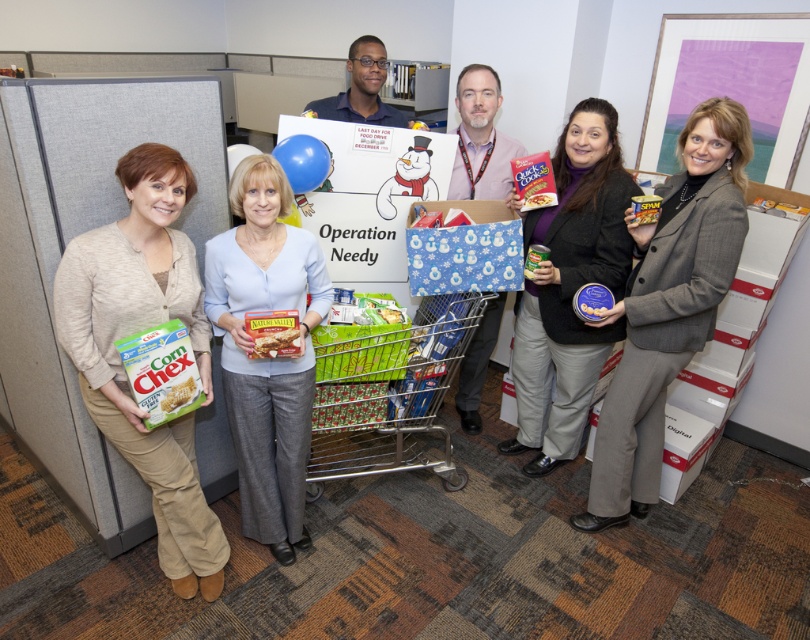
Looking at this image, is metallic shopping cart at center positioned in front of green matte corn chex at lower left?

No, it is behind green matte corn chex at lower left.

Is metallic shopping cart at center to the right of green matte corn chex at lower left from the viewer's perspective?

Yes, metallic shopping cart at center is to the right of green matte corn chex at lower left.

Locate an element on the screen. The height and width of the screenshot is (640, 810). metallic shopping cart at center is located at coordinates (388, 392).

You are a GUI agent. You are given a task and a screenshot of the screen. Output one action in this format:
    pyautogui.click(x=<x>, y=<y>)
    Task: Click on the metallic shopping cart at center
    Image resolution: width=810 pixels, height=640 pixels.
    Given the screenshot: What is the action you would take?
    coord(388,392)

This screenshot has width=810, height=640. What do you see at coordinates (139, 330) in the screenshot?
I see `green matte corn chex at left` at bounding box center [139, 330].

Measure the distance between green matte corn chex at left and matte gray blazer at right.

green matte corn chex at left is 1.63 meters from matte gray blazer at right.

Is point (92, 339) positioned behind point (666, 212)?

No, (92, 339) is in front of (666, 212).

This screenshot has width=810, height=640. In order to click on green matte corn chex at left in this screenshot , I will do pos(139,330).

Is point (173, 241) positioned in front of point (523, 396)?

Yes, point (173, 241) is in front of point (523, 396).

Who is more forward, (122, 384) or (522, 403)?

Point (122, 384) is more forward.

In order to click on green matte corn chex at left in this screenshot , I will do `click(139, 330)`.